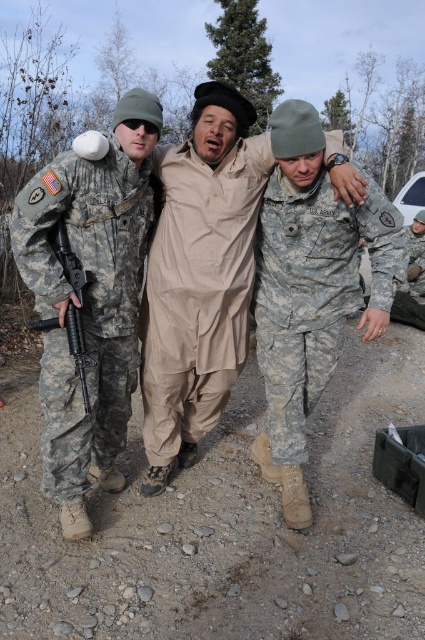
You are a photographer taking a group photo of the soldiers in the scene. Which soldier, the camouflage fabric uniform at left or the camouflage fabric uniform at center, should you adjust their position to make them appear more balanced in the frame?

The camouflage fabric uniform at left is smaller than the camouflage fabric uniform at center. To balance the frame, you should move the camouflage fabric uniform at left closer to the camera to increase their apparent size relative to the center soldier.

You are a drone operator trying to capture a clear aerial photo of the two points in the scene. The camera can only focus on objects that are in the same plane. Are the two points, point (235, 244) and point (78, 362), in the same plane?

Point (235, 244) is behind point (78, 362), so they are not in the same plane. The camera cannot focus on both simultaneously since they are at different depths.